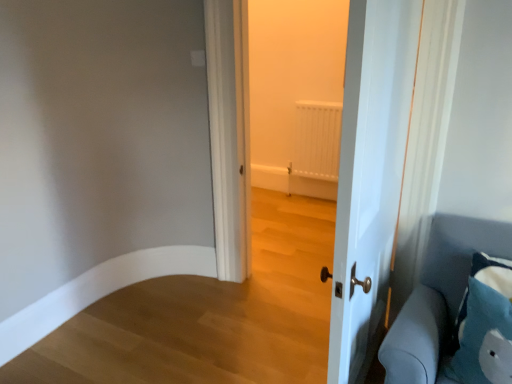
Question: Should I look upward or downward to see blue fabric pillow at lower right?

Choices:
 (A) down
 (B) up

Answer: (A)

Question: Can you see blue fabric pillow at lower right touching white glossy door at center?

Choices:
 (A) no
 (B) yes

Answer: (A)

Question: From a real-world perspective, is blue fabric pillow at lower right positioned over white glossy door at center based on gravity?

Choices:
 (A) no
 (B) yes

Answer: (A)

Question: Is blue fabric pillow at lower right behind white glossy door at center?

Choices:
 (A) yes
 (B) no

Answer: (A)

Question: Is blue fabric pillow at lower right looking in the opposite direction of white glossy door at center?

Choices:
 (A) no
 (B) yes

Answer: (A)

Question: Can white glossy door at center be found inside blue fabric pillow at lower right?

Choices:
 (A) yes
 (B) no

Answer: (B)

Question: Can you confirm if blue fabric pillow at lower right is wider than white glossy door at center?

Choices:
 (A) yes
 (B) no

Answer: (A)

Question: From a real-world perspective, is white glossy door at center on blue fabric pillow at lower right?

Choices:
 (A) yes
 (B) no

Answer: (A)

Question: Can you confirm if white glossy door at center is positioned to the right of blue fabric pillow at lower right?

Choices:
 (A) yes
 (B) no

Answer: (B)

Question: Could you tell me if white glossy door at center is facing blue fabric pillow at lower right?

Choices:
 (A) yes
 (B) no

Answer: (A)

Question: Is white glossy door at center closer to camera compared to blue fabric pillow at lower right?

Choices:
 (A) yes
 (B) no

Answer: (A)

Question: Does white glossy door at center have a greater height compared to blue fabric pillow at lower right?

Choices:
 (A) yes
 (B) no

Answer: (A)

Question: Does white glossy door at center have a greater width compared to blue fabric pillow at lower right?

Choices:
 (A) no
 (B) yes

Answer: (A)

Question: Is blue fabric pillow at lower right inside blue fabric pillow at lower right?

Choices:
 (A) no
 (B) yes

Answer: (A)